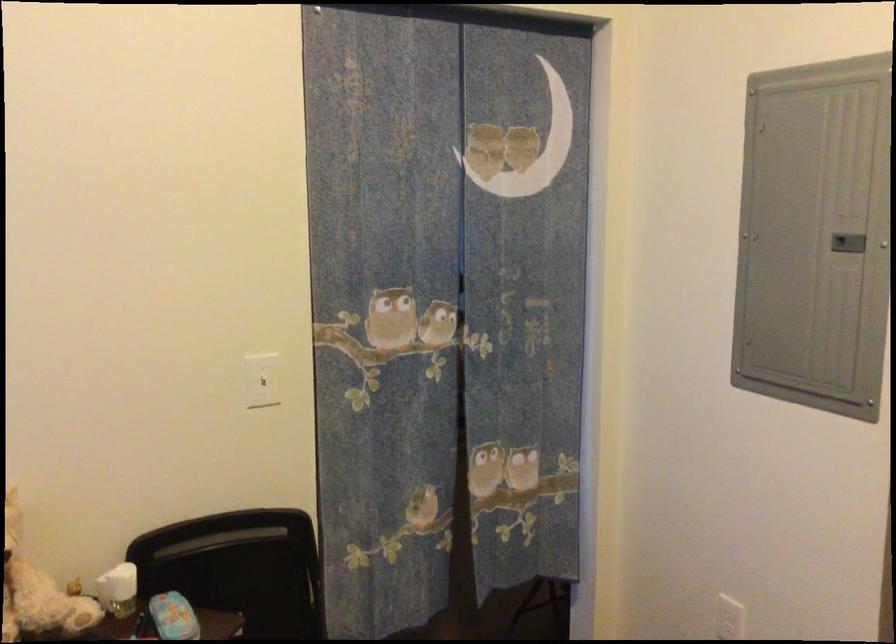
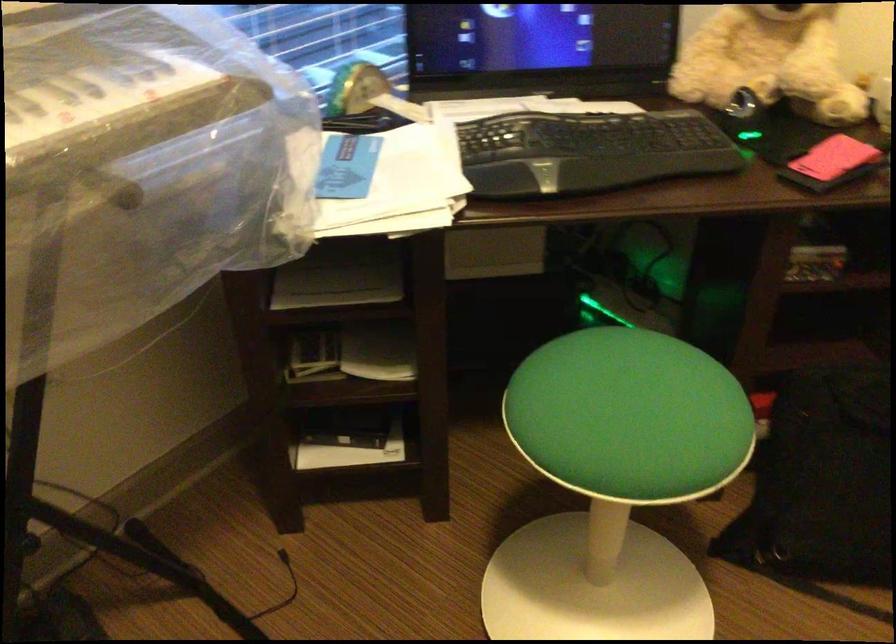
How did the camera likely rotate?

The rotation direction of the camera is left-down.